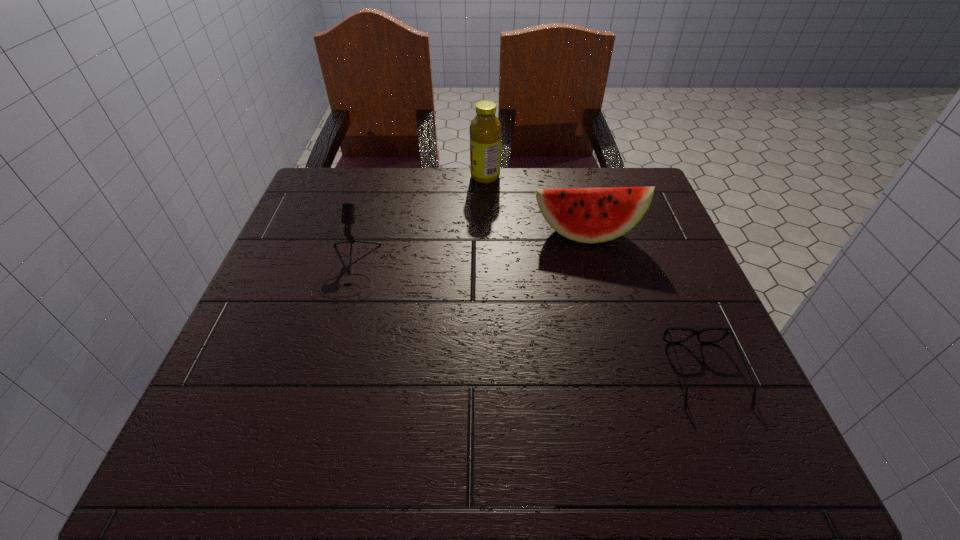
This screenshot has height=540, width=960. Find the location of `free space at the right edge`. free space at the right edge is located at coordinates (647, 222).

In the image, there is a desktop. Find the location of `vacant area at the far left corner`. vacant area at the far left corner is located at coordinates (368, 169).

The image size is (960, 540). In the image, there is a desktop. What are the coordinates of `free space at the near left corner` in the screenshot? It's located at (285, 443).

In the image, there is a desktop. Where is `free space at the near right corner`? This screenshot has width=960, height=540. free space at the near right corner is located at coordinates (732, 454).

You are a GUI agent. You are given a task and a screenshot of the screen. Output one action in this format:
    pyautogui.click(x=<x>, y=<y>)
    Task: Click on the free spot between the spectacles and the second tallest object
    This screenshot has width=960, height=540.
    Given the screenshot: What is the action you would take?
    pyautogui.click(x=644, y=304)

The height and width of the screenshot is (540, 960). I want to click on free space that is in between the spectacles and the watermelon, so click(644, 304).

Locate an element on the screen. The image size is (960, 540). vacant space in between the third object from right to left and the watermelon is located at coordinates (535, 205).

You are a GUI agent. You are given a task and a screenshot of the screen. Output one action in this format:
    pyautogui.click(x=<x>, y=<y>)
    Task: Click on the free space between the second tallest object and the spectacles
    The image size is (960, 540).
    Given the screenshot: What is the action you would take?
    pyautogui.click(x=644, y=304)

Locate an element on the screen. The height and width of the screenshot is (540, 960). free space between the leftmost object and the second object from left to right is located at coordinates (417, 224).

Where is `vacant area that lies between the microphone and the second object from left to right`? vacant area that lies between the microphone and the second object from left to right is located at coordinates (417, 224).